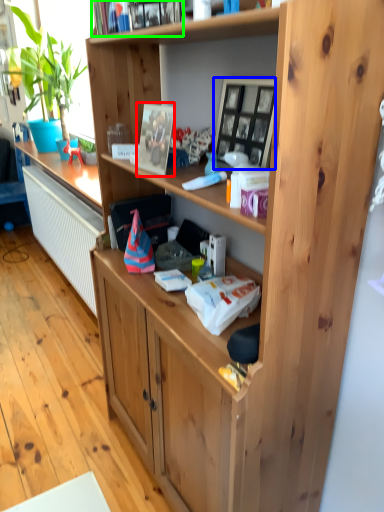
Question: Which object is positioned farthest from picture frame (highlighted by a red box)? Select from picture frame (highlighted by a blue box) and book (highlighted by a green box).

Choices:
 (A) picture frame
 (B) book

Answer: (B)